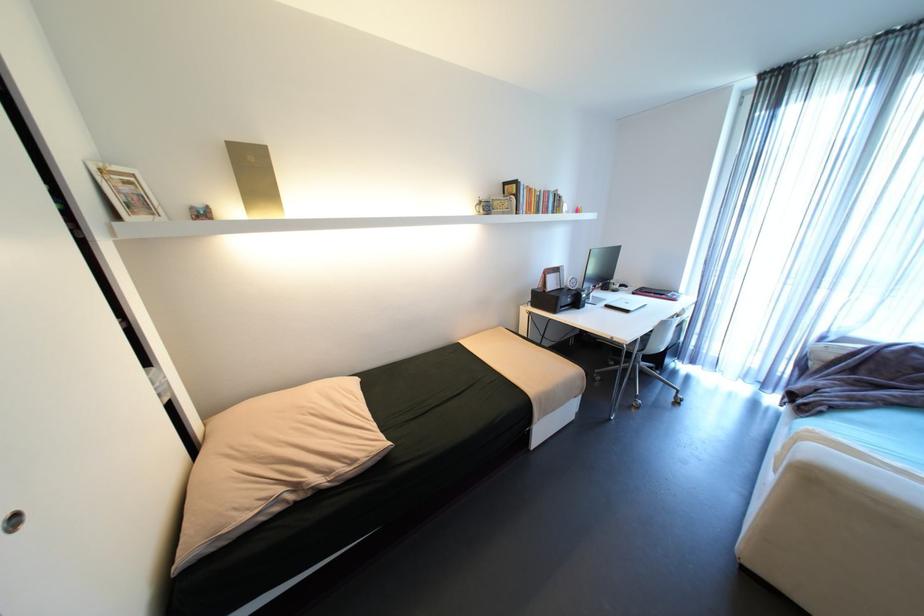
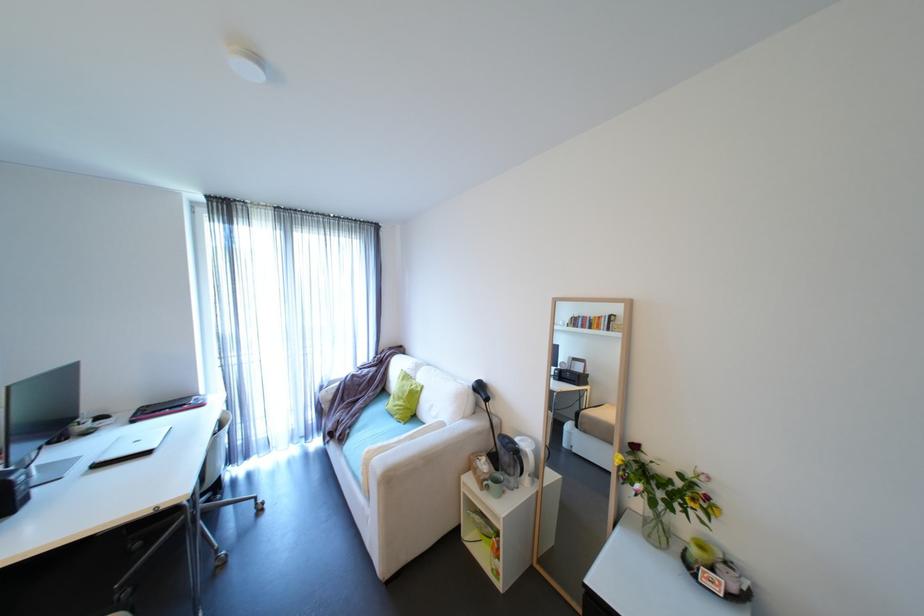
The point at (x=839, y=339) is marked in the first image. Where is the corresponding point in the second image?

(333, 386)